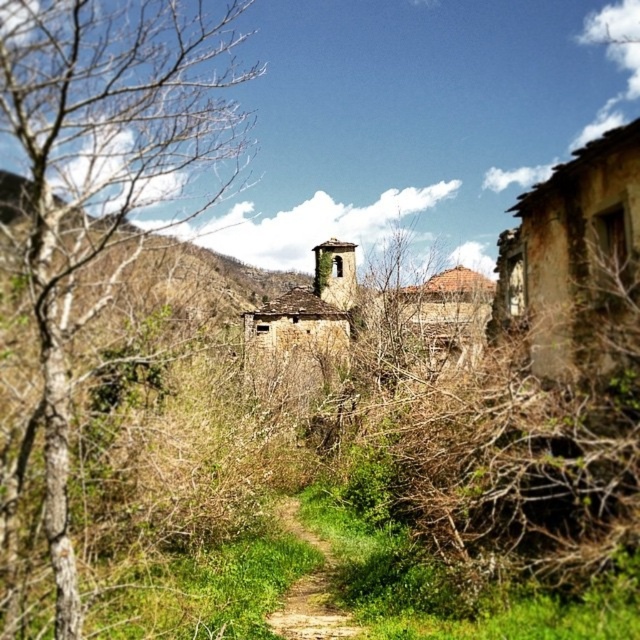
I want to click on bare wood tree at left, so [x=102, y=173].

Between bare wood tree at left and brown dirt path at center, which one is positioned higher?

bare wood tree at left

The height and width of the screenshot is (640, 640). Describe the element at coordinates (102, 173) in the screenshot. I see `bare wood tree at left` at that location.

The image size is (640, 640). I want to click on bare wood tree at left, so click(102, 173).